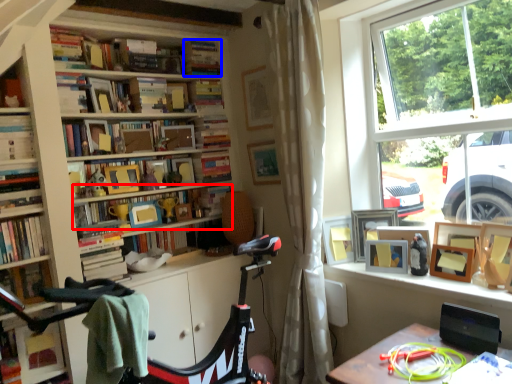
Question: Which point is further to the camera, book (highlighted by a red box) or book (highlighted by a blue box)?

Choices:
 (A) book
 (B) book

Answer: (B)